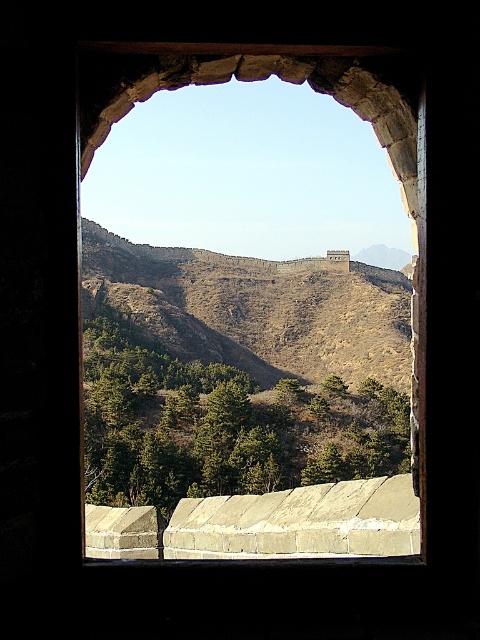
The width and height of the screenshot is (480, 640). What are the coordinates of `brown/dry grassy hillside at center` in the screenshot? It's located at (255, 308).

Is brown/dry grassy hillside at center bigger than stone archway at center?

Indeed, brown/dry grassy hillside at center has a larger size compared to stone archway at center.

This screenshot has height=640, width=480. Describe the element at coordinates (255, 308) in the screenshot. I see `brown/dry grassy hillside at center` at that location.

At what (x,y) coordinates should I click in order to perform the action: click on brown/dry grassy hillside at center. Please return your answer as a coordinate pair (x, y). Looking at the image, I should click on click(255, 308).